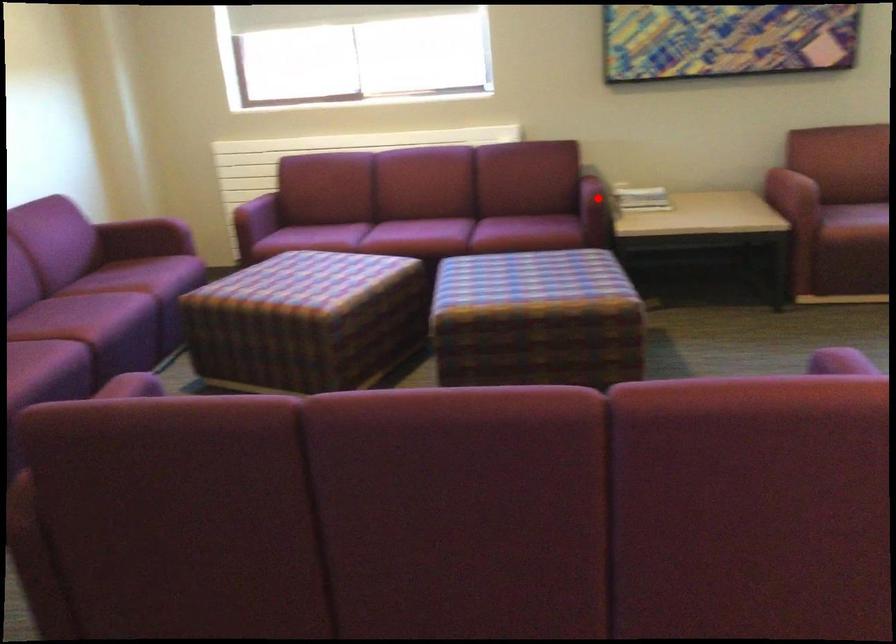
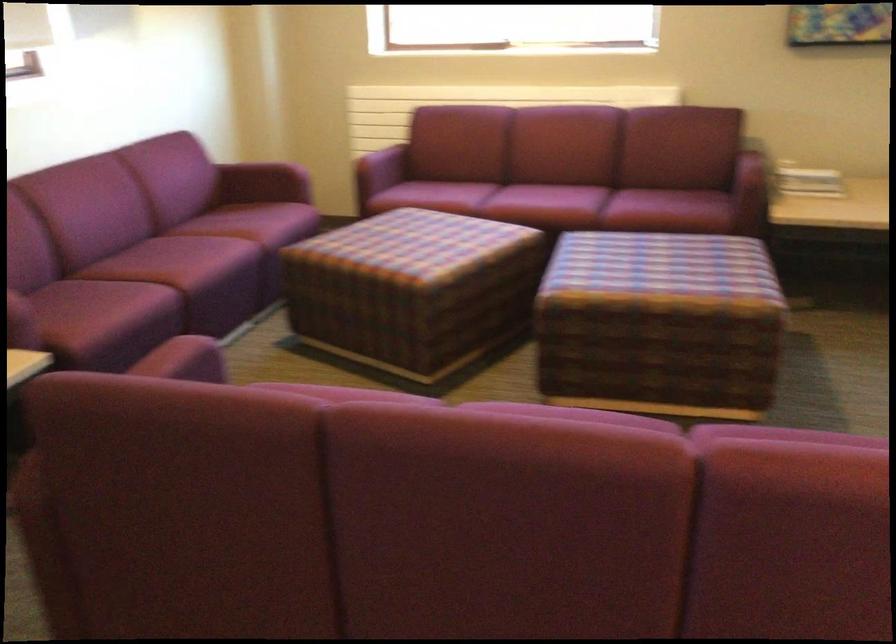
The point at the highlighted location is marked in the first image. Where is the corresponding point in the second image?

(753, 180)